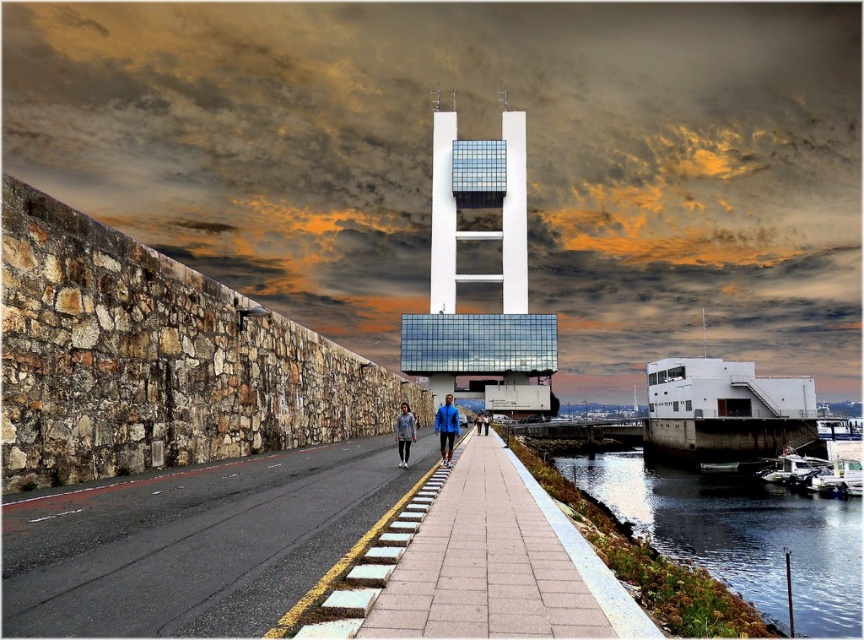
Who is higher up, paved stone sidewalk at center or white glass building at center?

white glass building at center is above.

Measure the distance between paved stone sidewalk at center and white glass building at center.

A distance of 495.17 feet exists between paved stone sidewalk at center and white glass building at center.

Image resolution: width=864 pixels, height=640 pixels. Describe the element at coordinates (491, 561) in the screenshot. I see `paved stone sidewalk at center` at that location.

Locate an element on the screen. paved stone sidewalk at center is located at coordinates (491, 561).

Find the location of a particular element. The height and width of the screenshot is (640, 864). concrete paving at center is located at coordinates (195, 541).

Does point (261, 630) come farther from viewer compared to point (534, 488)?

No, it is in front of (534, 488).

In order to click on concrete paving at center in this screenshot , I will do `click(195, 541)`.

Does blue fabric jacket at center appear on the right side of denim jacket at center?

Yes, blue fabric jacket at center is to the right of denim jacket at center.

Which is below, blue fabric jacket at center or denim jacket at center?

denim jacket at center is below.

Where is `blue fabric jacket at center`? The image size is (864, 640). blue fabric jacket at center is located at coordinates (446, 428).